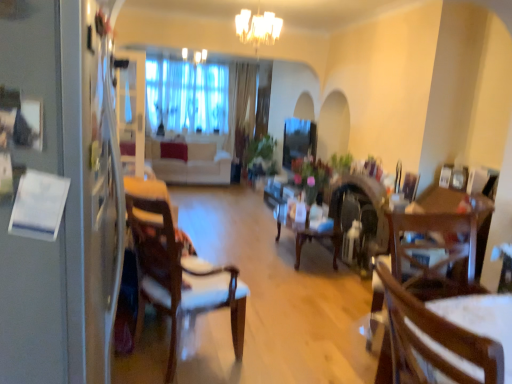
Where is `wooden chair at right, the 1th chair positioned from the back`? The height and width of the screenshot is (384, 512). wooden chair at right, the 1th chair positioned from the back is located at coordinates (434, 253).

What do you see at coordinates (58, 194) in the screenshot?
I see `white glossy fridge at left` at bounding box center [58, 194].

Image resolution: width=512 pixels, height=384 pixels. What do you see at coordinates (298, 140) in the screenshot?
I see `transparent glass window screen at center` at bounding box center [298, 140].

What do you see at coordinates (180, 277) in the screenshot?
I see `white fabric chair at left, marked as the third chair in a right-to-left arrangement` at bounding box center [180, 277].

Describe the element at coordinates (191, 164) in the screenshot. This screenshot has width=512, height=384. I see `velvet beige couch at center` at that location.

Measure the distance between velvet beige couch at center and camera.

velvet beige couch at center is 6.51 meters away from camera.

Image resolution: width=512 pixels, height=384 pixels. In order to click on white glass chandelier at upper center in this screenshot , I will do `click(258, 27)`.

Is velvet beige couch at center positioned behind white fabric chair at left, marked as the third chair in a right-to-left arrangement?

Yes, the depth of velvet beige couch at center is greater than that of white fabric chair at left, marked as the third chair in a right-to-left arrangement.

Is velvet beige couch at center situated inside white fabric chair at left, the first chair positioned from the left, or outside?

velvet beige couch at center exists outside the volume of white fabric chair at left, the first chair positioned from the left.

From a real-world perspective, which object stands above the other?

white fabric chair at left, which is the second chair in front-to-back order, is physically above.

From their relative heights in the image, would you say velvet beige couch at center is taller or shorter than white fabric chair at left, which ranks as the 2th chair in back-to-front order?

Considering their sizes, velvet beige couch at center has less height than white fabric chair at left, which ranks as the 2th chair in back-to-front order.

Which is closer, (x=200, y=157) or (x=293, y=129)?

The point (x=293, y=129) is closer to the camera.

Could you tell me if velvet beige couch at center is turned towards transparent glass window screen at center?

Yes, velvet beige couch at center is oriented towards transparent glass window screen at center.

In the scene shown: Which is more to the right, velvet beige couch at center or transparent glass window screen at center?

transparent glass window screen at center.

Can you confirm if velvet beige couch at center is smaller than transparent glass window screen at center?

No.

From the image's perspective, which chair is the 2nd one below the white glass chandelier at upper center? Please provide its 2D coordinates.

[(434, 253)]

Considering the sizes of wooden chair at right, the 1th chair positioned from the back, and white glass chandelier at upper center in the image, is wooden chair at right, the 1th chair positioned from the back, bigger or smaller than white glass chandelier at upper center?

In the image, wooden chair at right, the 1th chair positioned from the back, appears to be larger than white glass chandelier at upper center.

From a real-world perspective, is wooden chair at right, placed as the third chair when sorted from front to back, physically below white glass chandelier at upper center?

Yes, from a real-world perspective, wooden chair at right, placed as the third chair when sorted from front to back, is under white glass chandelier at upper center.

Considering the relative sizes of wooden chair at right, positioned as the third chair in left-to-right order, and white glass chandelier at upper center in the image provided, is wooden chair at right, positioned as the third chair in left-to-right order, taller than white glass chandelier at upper center?

Correct, wooden chair at right, positioned as the third chair in left-to-right order, is much taller as white glass chandelier at upper center.

The width and height of the screenshot is (512, 384). What are the coordinates of `window screen in front of the velvet beige couch at center` in the screenshot? It's located at (298, 140).

From the picture: Does transparent glass window screen at center have a lesser height compared to velvet beige couch at center?

No, transparent glass window screen at center is not shorter than velvet beige couch at center.

Can we say transparent glass window screen at center lies outside velvet beige couch at center?

Indeed, transparent glass window screen at center is completely outside velvet beige couch at center.

From the image's perspective, is white fabric chair at left, the first chair positioned from the left, under wooden table at center?

Indeed, from the image's perspective, white fabric chair at left, the first chair positioned from the left, is shown beneath wooden table at center.

Which object is positioned more to the left, white fabric chair at left, which ranks as the 2th chair in back-to-front order, or wooden table at center?

Positioned to the left is white fabric chair at left, which ranks as the 2th chair in back-to-front order.

Is white fabric chair at left, which ranks as the 2th chair in back-to-front order, turned away from wooden table at center?

No.

From a real-world perspective, is white fabric chair at left, the first chair positioned from the left, under wooden table at center?

No, from a real-world perspective, white fabric chair at left, the first chair positioned from the left, is not under wooden table at center.

Is white fabric chair at left, which is the second chair in front-to-back order, bigger than wooden chair at right, positioned as the third chair in left-to-right order?

Yes, white fabric chair at left, which is the second chair in front-to-back order, is bigger than wooden chair at right, positioned as the third chair in left-to-right order.

From a real-world perspective, who is located higher, white fabric chair at left, marked as the third chair in a right-to-left arrangement, or wooden chair at right, the first chair positioned from the right?

white fabric chair at left, marked as the third chair in a right-to-left arrangement.

Are white fabric chair at left, marked as the third chair in a right-to-left arrangement, and wooden chair at right, placed as the third chair when sorted from front to back, far apart?

Indeed, white fabric chair at left, marked as the third chair in a right-to-left arrangement, is not near wooden chair at right, placed as the third chair when sorted from front to back.

Measure the distance from white fabric chair at left, the first chair positioned from the left, to wooden chair at right, the first chair positioned from the right.

A distance of 1.10 meters exists between white fabric chair at left, the first chair positioned from the left, and wooden chair at right, the first chair positioned from the right.

From a real-world perspective, which is physically below, wooden chair at right, positioned as the third chair in left-to-right order, or white fabric chair at left, marked as the third chair in a right-to-left arrangement?

wooden chair at right, positioned as the third chair in left-to-right order, is physically lower.

Considering the sizes of wooden chair at right, the first chair positioned from the right, and white fabric chair at left, which is the second chair in front-to-back order, in the image, is wooden chair at right, the first chair positioned from the right, taller or shorter than white fabric chair at left, which is the second chair in front-to-back order,?

Clearly, wooden chair at right, the first chair positioned from the right, is shorter compared to white fabric chair at left, which is the second chair in front-to-back order.

From the image's perspective, does wooden chair at right, positioned as the third chair in left-to-right order, appear higher than white fabric chair at left, marked as the third chair in a right-to-left arrangement?

No, from the image's perspective, wooden chair at right, positioned as the third chair in left-to-right order, is not over white fabric chair at left, marked as the third chair in a right-to-left arrangement.

How many degrees apart are the facing directions of wooden chair at right, the first chair positioned from the right, and white fabric chair at left, the first chair positioned from the left?

There is a 123-degree angle between the facing directions of wooden chair at right, the first chair positioned from the right, and white fabric chair at left, the first chair positioned from the left.

Locate an element on the screen. This screenshot has height=384, width=512. the 2nd chair positioned above the velvet beige couch at center (from a real-world perspective) is located at coordinates (180, 277).

Find the location of `couch that appears on the left of transparent glass window screen at center`. couch that appears on the left of transparent glass window screen at center is located at coordinates click(191, 164).

Considering their positions, is wooden chair at center, which is the 2th chair from right to left, positioned further to white fabric chair at left, which ranks as the 2th chair in back-to-front order, than white glass chandelier at upper center?

The object further to white fabric chair at left, which ranks as the 2th chair in back-to-front order, is white glass chandelier at upper center.

Which object lies further to the anchor point white fabric chair at left, the first chair positioned from the left, white glossy fridge at left or wooden chair at center, which is the 3th chair from back to front?

wooden chair at center, which is the 3th chair from back to front, lies further to white fabric chair at left, the first chair positioned from the left, than the other object.

Which object lies further to the anchor point transparent glass window screen at center, wooden table at center or wooden chair at center, marked as the first chair in a front-to-back arrangement?

wooden chair at center, marked as the first chair in a front-to-back arrangement.

Looking at the image, which one is located further to wooden table at center, wooden chair at right, placed as the third chair when sorted from front to back, or white fabric chair at left, which ranks as the 2th chair in back-to-front order?

The object further to wooden table at center is white fabric chair at left, which ranks as the 2th chair in back-to-front order.

Which object lies further to the anchor point transparent glass window screen at center, wooden chair at right, the 1th chair positioned from the back, or white glossy fridge at left?

white glossy fridge at left lies further to transparent glass window screen at center than the other object.

From the image, which object appears to be nearer to white fabric chair at left, which ranks as the 2th chair in back-to-front order, wooden chair at center, placed as the 2th chair when sorted from left to right, or velvet beige couch at center?

wooden chair at center, placed as the 2th chair when sorted from left to right.

Looking at the image, which one is located further to transparent glass window screen at center, white fabric chair at left, the first chair positioned from the left, or white glass chandelier at upper center?

white fabric chair at left, the first chair positioned from the left, is further to transparent glass window screen at center.

Considering their positions, is velvet beige couch at center positioned closer to wooden table at center than wooden chair at right, placed as the third chair when sorted from front to back?

wooden chair at right, placed as the third chair when sorted from front to back.

This screenshot has height=384, width=512. Find the location of `chair between white fabric chair at left, the first chair positioned from the left, and wooden chair at right, placed as the third chair when sorted from front to back`. chair between white fabric chair at left, the first chair positioned from the left, and wooden chair at right, placed as the third chair when sorted from front to back is located at coordinates tap(448, 336).

At what (x,y) coordinates should I click in order to perform the action: click on window screen that lies between white glass chandelier at upper center and wooden table at center from top to bottom. Please return your answer as a coordinate pair (x, y). This screenshot has height=384, width=512. Looking at the image, I should click on (298, 140).

Locate an element on the screen. window screen between white glass chandelier at upper center and velvet beige couch at center from front to back is located at coordinates (298, 140).

Identify the location of chair located between white glossy fridge at left and wooden chair at center, which is the 3th chair from back to front, in the left-right direction. The height and width of the screenshot is (384, 512). click(180, 277).